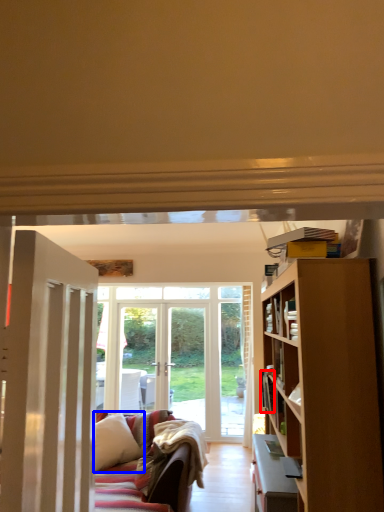
Question: Which object is closer to the camera taking this photo, book (highlighted by a red box) or pillow (highlighted by a blue box)?

Choices:
 (A) book
 (B) pillow

Answer: (A)